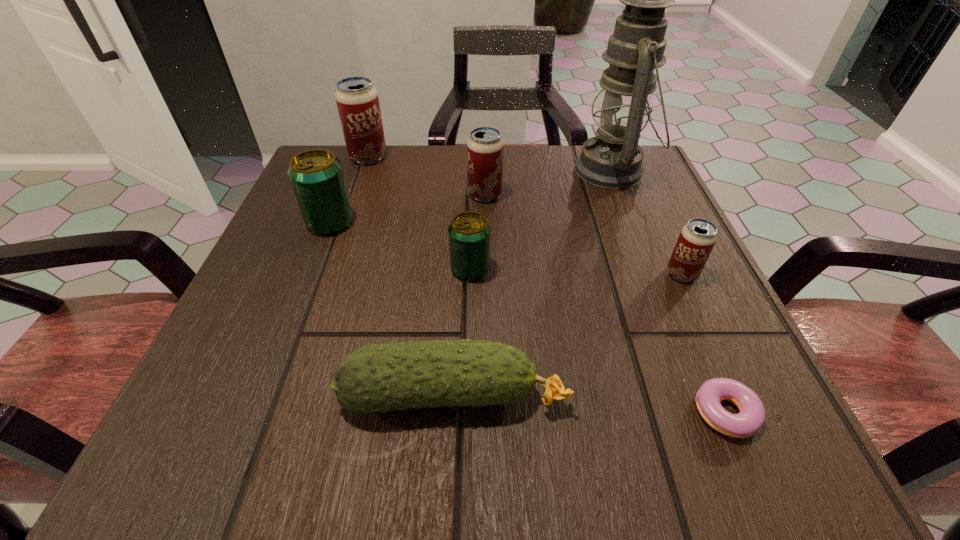
Where is `free space between the second red beer can from right to left and the green cucumber`? This screenshot has height=540, width=960. free space between the second red beer can from right to left and the green cucumber is located at coordinates (469, 295).

Locate an element on the screen. vacant space that is in between the shortest object and the tallest object is located at coordinates (667, 292).

This screenshot has width=960, height=540. In order to click on free space between the nearer green beer can and the farther green beer can in this screenshot , I will do `click(400, 246)`.

Where is `free space between the doughnut and the leftmost red beer can`? The width and height of the screenshot is (960, 540). free space between the doughnut and the leftmost red beer can is located at coordinates (545, 285).

This screenshot has width=960, height=540. What are the coordinates of `free space between the shortest object and the green cucumber` in the screenshot? It's located at (588, 404).

Where is `unoccupied area between the doughnut and the right green beer can`? This screenshot has height=540, width=960. unoccupied area between the doughnut and the right green beer can is located at coordinates (596, 341).

The height and width of the screenshot is (540, 960). Identify the location of free space between the fifth nearest object and the nearest red beer can. (506, 248).

Locate an element on the screen. object that ranks as the fifth closest to the rightmost red beer can is located at coordinates (485, 146).

Where is `object that is the fifth closest to the shortest object`? This screenshot has height=540, width=960. object that is the fifth closest to the shortest object is located at coordinates (485, 146).

Locate an element on the screen. The image size is (960, 540). beer can that is the third nearest to the second red beer can from left to right is located at coordinates (316, 175).